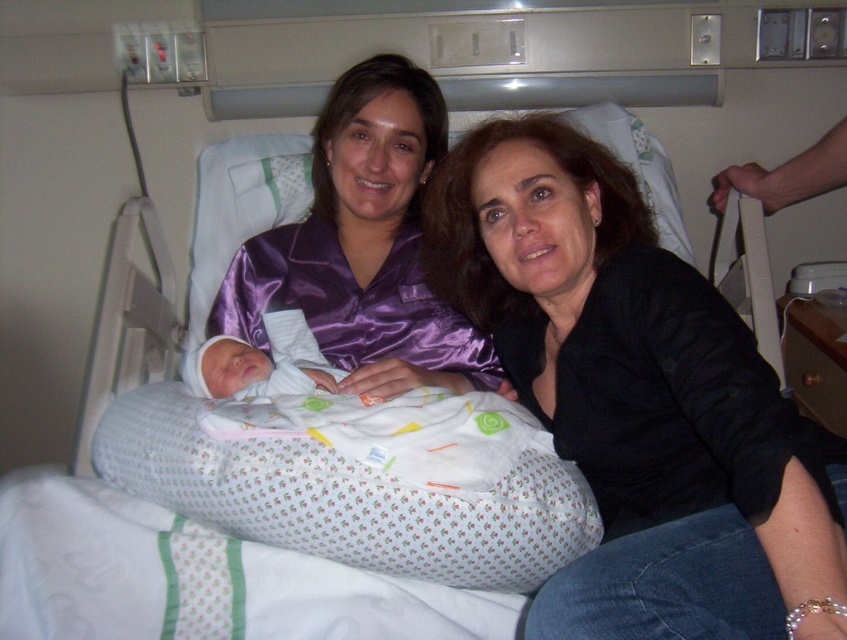
Question: Based on their relative distances, which object is farther from the soft white swaddled newborn at center?

Choices:
 (A) black satin shirt at center
 (B) purple satin pajamas at center

Answer: (A)

Question: Which object appears closest to the camera in this image?

Choices:
 (A) black satin shirt at center
 (B) soft white swaddled newborn at center

Answer: (A)

Question: Is black satin shirt at center to the right of soft white swaddled newborn at center from the viewer's perspective?

Choices:
 (A) no
 (B) yes

Answer: (B)

Question: Which object appears farthest from the camera in this image?

Choices:
 (A) purple satin pajamas at center
 (B) soft white swaddled newborn at center

Answer: (B)

Question: Is the position of purple satin pajamas at center less distant than that of soft white swaddled newborn at center?

Choices:
 (A) yes
 (B) no

Answer: (A)

Question: Does purple satin pajamas at center appear on the left side of soft white swaddled newborn at center?

Choices:
 (A) yes
 (B) no

Answer: (B)